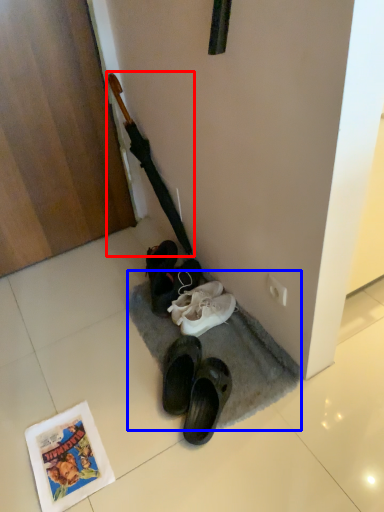
Question: Among these objects, which one is nearest to the camera, crucifix (highlighted by a red box) or doormat (highlighted by a blue box)?

Choices:
 (A) crucifix
 (B) doormat

Answer: (B)